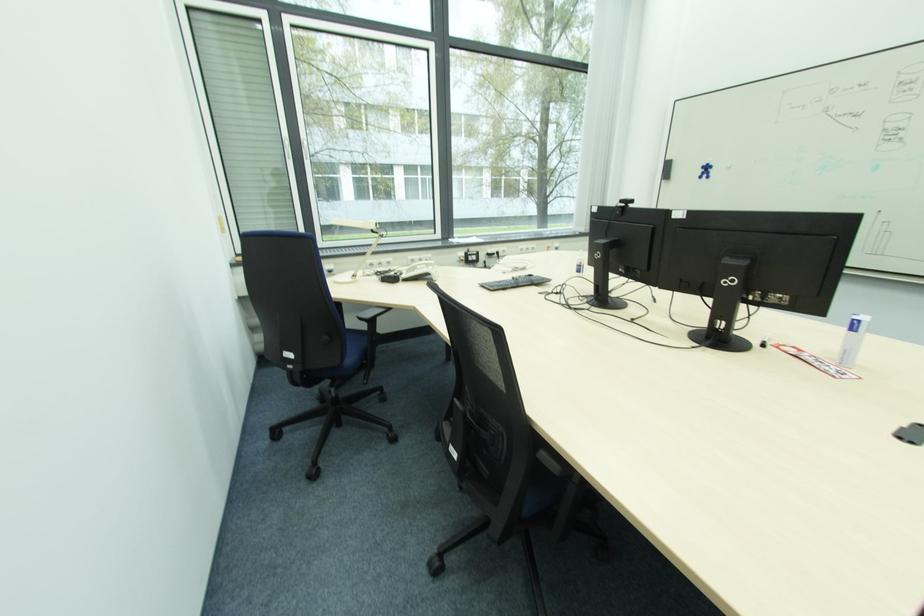
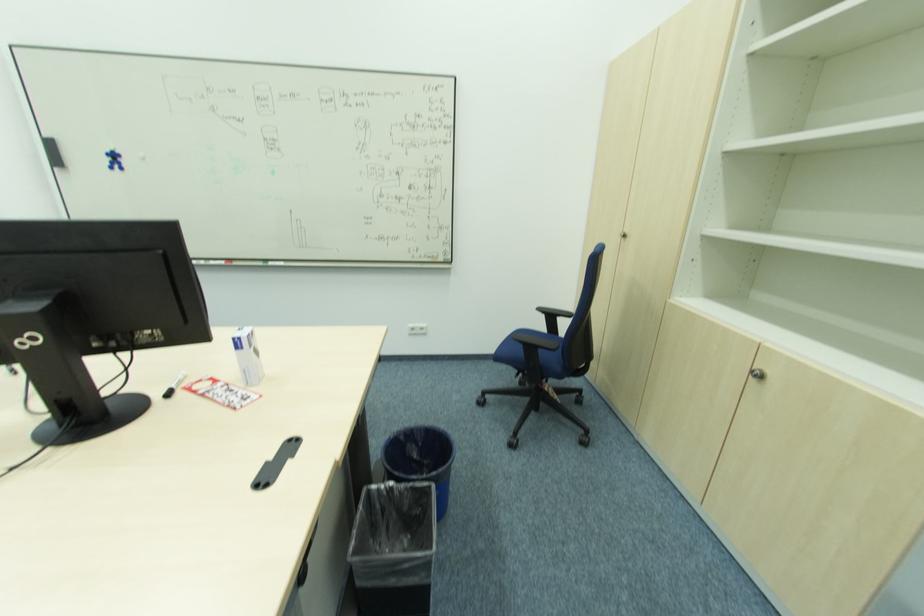
Locate, in the second image, the point that corresponds to the point at 707,172 in the first image.

(116, 161)